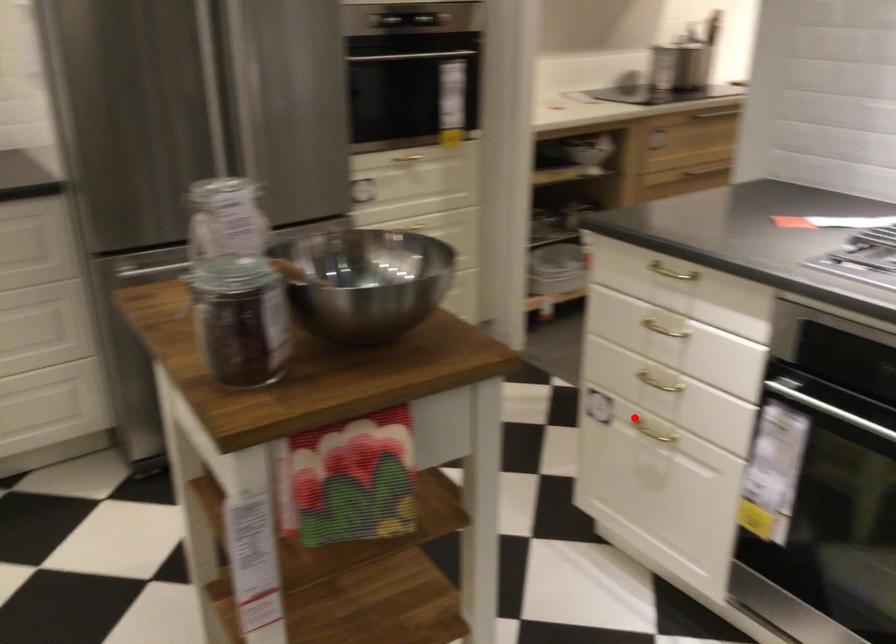
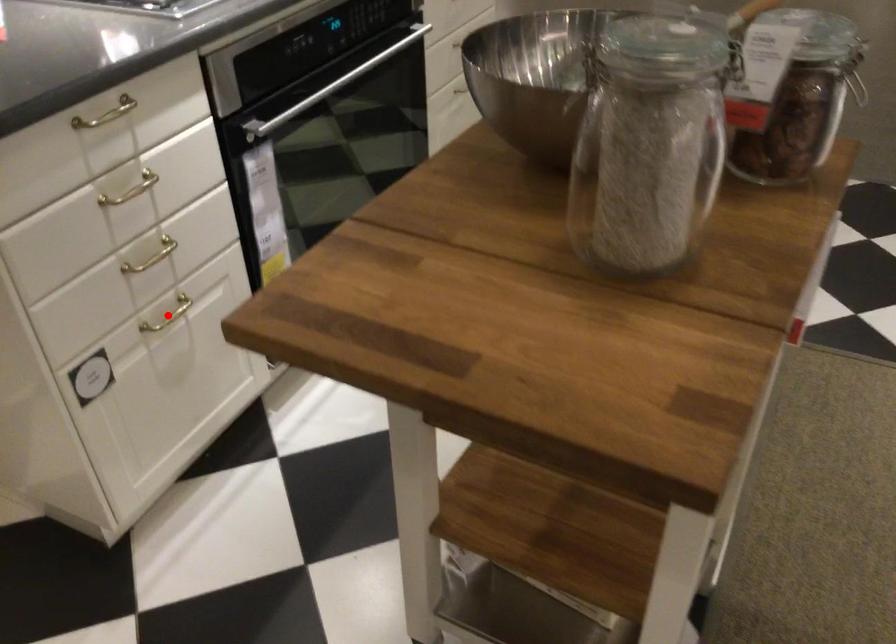
I am providing you with two images of the same scene from different viewpoints. A red point is marked on the first image and another point is marked on the second image. Are the points marked in image1 and image2 representing the same 3D position?

Yes